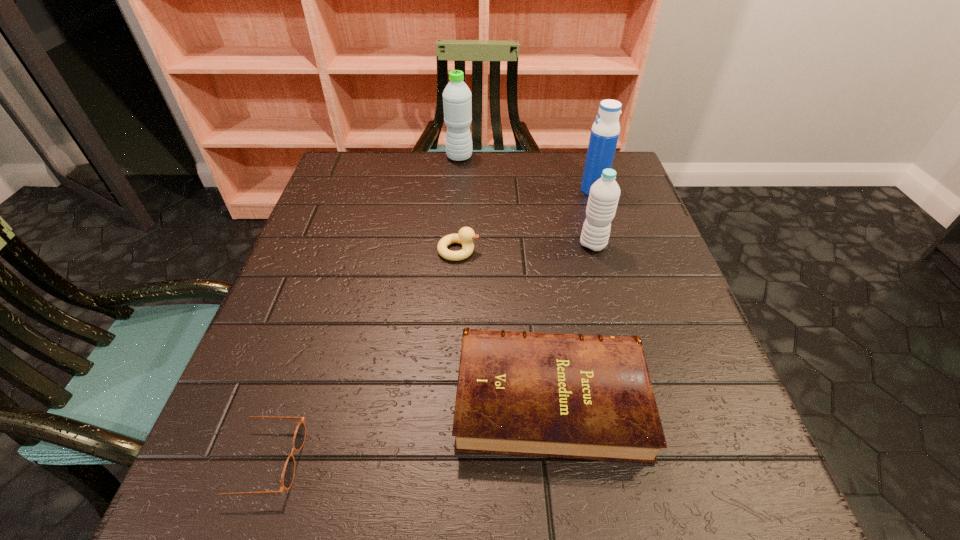
The image size is (960, 540). I want to click on free area in between the third tallest object and the duckling, so click(x=525, y=248).

At what (x,y) coordinates should I click in order to perform the action: click on empty space that is in between the duckling and the hardback book. Please return your answer as a coordinate pair (x, y). The height and width of the screenshot is (540, 960). Looking at the image, I should click on (504, 324).

Locate an element on the screen. blank region between the duckling and the sunglasses is located at coordinates (360, 356).

In order to click on free spot between the fifth nearest object and the hardback book in this screenshot , I will do `click(571, 294)`.

Where is `vacant space that is in between the fifth nearest object and the hardback book`? vacant space that is in between the fifth nearest object and the hardback book is located at coordinates (571, 294).

Where is `vacant area between the duckling and the shortest object`? The height and width of the screenshot is (540, 960). vacant area between the duckling and the shortest object is located at coordinates (360, 356).

Identify the location of vacant area that lies between the fourth shortest object and the leftmost object. This screenshot has width=960, height=540. (427, 353).

Choose which object is the fourth nearest neighbor to the hardback book. Please provide its 2D coordinates. Your answer should be formatted as a tuple, i.e. [(x, y)], where the tuple contains the x and y coordinates of a point satisfying the conditions above.

[(605, 131)]

Identify the location of object that is the closest to the leftmost water bottle. (605, 131).

Select which water bottle appears as the closest to the third tallest object. Please provide its 2D coordinates. Your answer should be formatted as a tuple, i.e. [(x, y)], where the tuple contains the x and y coordinates of a point satisfying the conditions above.

[(605, 131)]